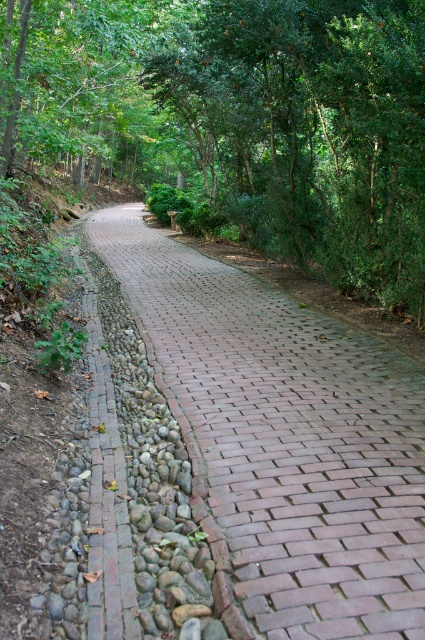
Question: From the image, what is the correct spatial relationship of green leafy forest at center in relation to brick paved path at center?

Choices:
 (A) left
 (B) right

Answer: (A)

Question: Which point is closer to the camera?

Choices:
 (A) (272, 426)
 (B) (220, 38)

Answer: (A)

Question: Which of the following is the farthest from the observer?

Choices:
 (A) pos(153,342)
 (B) pos(353,188)

Answer: (B)

Question: Can you confirm if green leafy forest at center is positioned above brick paved path at center?

Choices:
 (A) yes
 (B) no

Answer: (A)

Question: Where is green leafy forest at center located in relation to brick paved path at center in the image?

Choices:
 (A) left
 (B) right

Answer: (A)

Question: Which of the following is the farthest from the observer?

Choices:
 (A) (393, 429)
 (B) (132, 109)

Answer: (B)